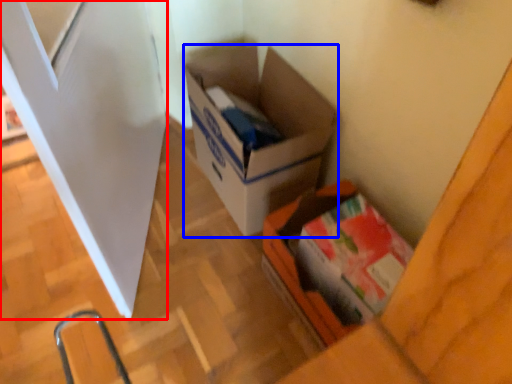
Question: Which point is closer to the camera, screen door (highlighted by a red box) or box (highlighted by a blue box)?

Choices:
 (A) screen door
 (B) box

Answer: (A)